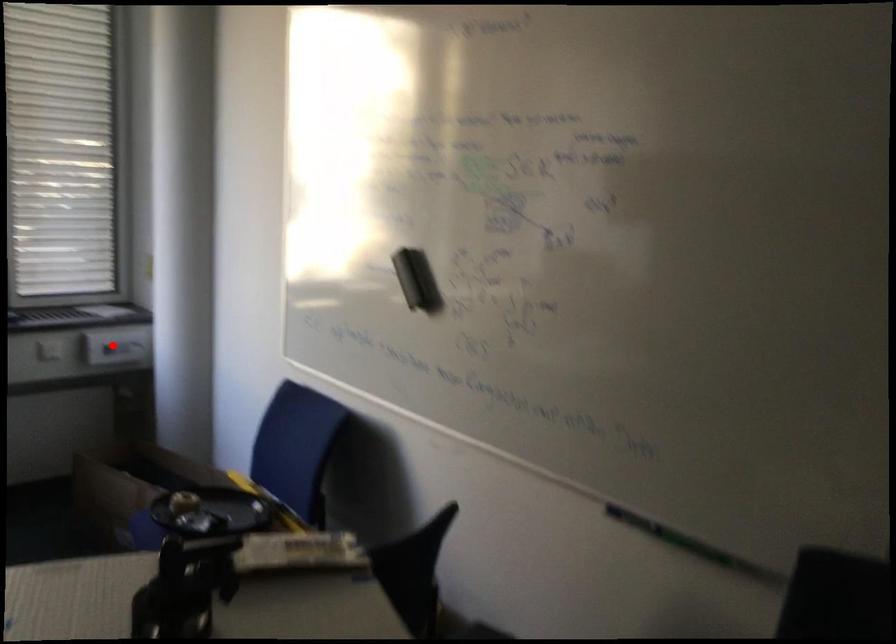
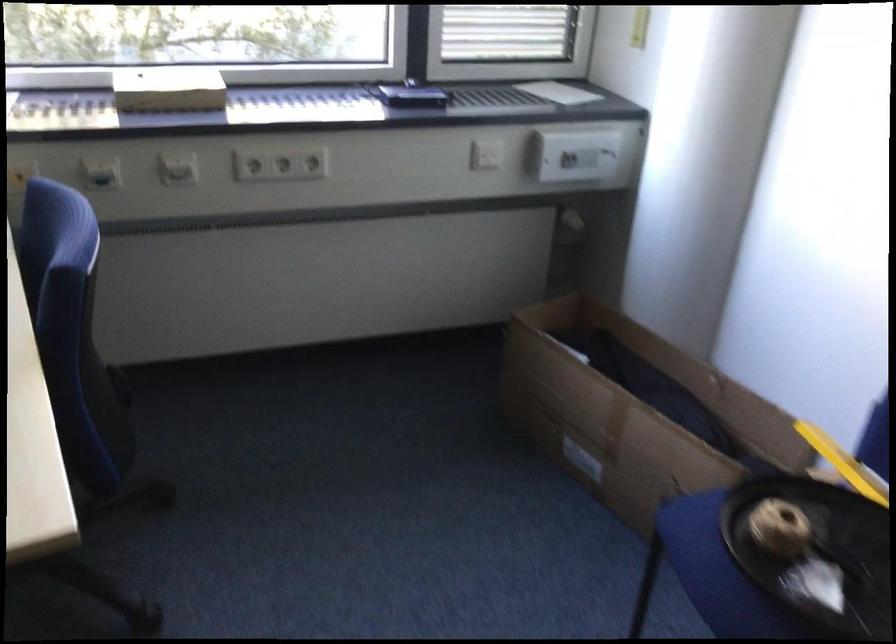
In the second image, find the point that corresponds to the highlighted location in the first image.

(576, 155)